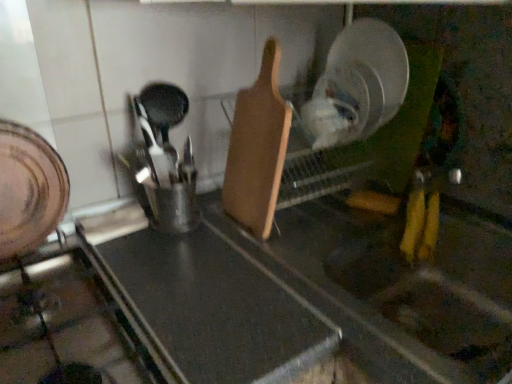
This screenshot has height=384, width=512. What do you see at coordinates (70, 322) in the screenshot? I see `brushed metal gas stove at lower left` at bounding box center [70, 322].

Find the location of a particular element. This screenshot has height=384, width=512. wooden cutting board at center is located at coordinates (257, 149).

Does brushed metal gas stove at lower left turn towards wooden cutting board at center?

No, brushed metal gas stove at lower left is not oriented towards wooden cutting board at center.

How many degrees apart are the facing directions of brushed metal gas stove at lower left and wooden cutting board at center?

brushed metal gas stove at lower left and wooden cutting board at center are facing 90 degrees away from each other.

Can you confirm if brushed metal gas stove at lower left is thinner than wooden cutting board at center?

In fact, brushed metal gas stove at lower left might be wider than wooden cutting board at center.

Is brushed metal gas stove at lower left outside of wooden cutting board at center?

Absolutely, brushed metal gas stove at lower left is external to wooden cutting board at center.

From the picture: Can you confirm if wooden cutting board at center is positioned to the right of brushed metal gas stove at lower left?

Correct, you'll find wooden cutting board at center to the right of brushed metal gas stove at lower left.

Consider the image. Is wooden cutting board at center not within brushed metal gas stove at lower left?

Indeed, wooden cutting board at center is completely outside brushed metal gas stove at lower left.

From a real-world perspective, is wooden cutting board at center physically below brushed metal gas stove at lower left?

No, from a real-world perspective, wooden cutting board at center is not under brushed metal gas stove at lower left.

Looking at this image, can you confirm if wooden cutting board at center is wider than brushed metal gas stove at lower left?

No, wooden cutting board at center is not wider than brushed metal gas stove at lower left.

Which object is positioned more to the right, black matte cutting board at center or brushed metal gas stove at lower left?

black matte cutting board at center.

Which of these two, black matte cutting board at center or brushed metal gas stove at lower left, stands shorter?

brushed metal gas stove at lower left.

Would you consider black matte cutting board at center to be distant from brushed metal gas stove at lower left?

Actually, black matte cutting board at center and brushed metal gas stove at lower left are a little close together.

Between black matte cutting board at center and wooden cutting board at center, which one has larger size?

black matte cutting board at center.

From a real-world perspective, does black matte cutting board at center stand above wooden cutting board at center?

No, from a real-world perspective, black matte cutting board at center is not on top of wooden cutting board at center.

Considering the relative positions of brushed metal gas stove at lower left and black matte cutting board at center in the image provided, is brushed metal gas stove at lower left behind black matte cutting board at center?

No, brushed metal gas stove at lower left is closer to the viewer.

Measure the distance from brushed metal gas stove at lower left to black matte cutting board at center.

brushed metal gas stove at lower left and black matte cutting board at center are 4.27 inches apart from each other.

Considering the positions of objects brushed metal gas stove at lower left and black matte cutting board at center in the image provided, who is more to the left, brushed metal gas stove at lower left or black matte cutting board at center?

Positioned to the left is brushed metal gas stove at lower left.

Is brushed metal gas stove at lower left taller or shorter than black matte cutting board at center?

brushed metal gas stove at lower left is shorter than black matte cutting board at center.

Is wooden cutting board at center inside the boundaries of black matte cutting board at center, or outside?

wooden cutting board at center exists outside the volume of black matte cutting board at center.

Image resolution: width=512 pixels, height=384 pixels. I want to click on spatula above the black matte cutting board at center (from a real-world perspective), so click(257, 149).

Are wooden cutting board at center and black matte cutting board at center beside each other?

They are not placed beside each other.

Which is behind, wooden cutting board at center or black matte cutting board at center?

Positioned behind is wooden cutting board at center.

The image size is (512, 384). Identify the location of gas stove on the left of wooden cutting board at center. (70, 322).

You are a GUI agent. You are given a task and a screenshot of the screen. Output one action in this format:
    pyautogui.click(x=<x>, y=<y>)
    Task: Click on the spatula above the brushed metal gas stove at lower left (from a real-world perspective)
    The height and width of the screenshot is (384, 512).
    Given the screenshot: What is the action you would take?
    pyautogui.click(x=257, y=149)

From the image, which object appears to be nearer to wooden cutting board at center, brushed metal gas stove at lower left or black matte cutting board at center?

The object closer to wooden cutting board at center is black matte cutting board at center.

Which object lies nearer to the anchor point brushed metal gas stove at lower left, wooden cutting board at center or black matte cutting board at center?

black matte cutting board at center.

Estimate the real-world distances between objects in this image. Which object is closer to brushed metal gas stove at lower left, black matte cutting board at center or wooden cutting board at center?

The object closer to brushed metal gas stove at lower left is black matte cutting board at center.

Estimate the real-world distances between objects in this image. Which object is closer to wooden cutting board at center, black matte cutting board at center or brushed metal gas stove at lower left?

Based on the image, black matte cutting board at center appears to be nearer to wooden cutting board at center.

Which object lies further to the anchor point black matte cutting board at center, brushed metal gas stove at lower left or wooden cutting board at center?

wooden cutting board at center lies further to black matte cutting board at center than the other object.

Which object lies further to the anchor point black matte cutting board at center, wooden cutting board at center or brushed metal gas stove at lower left?

wooden cutting board at center is positioned further to the anchor black matte cutting board at center.

Locate an element on the screen. gas stove between wooden cutting board at center and black matte cutting board at center in the up-down direction is located at coordinates (70, 322).